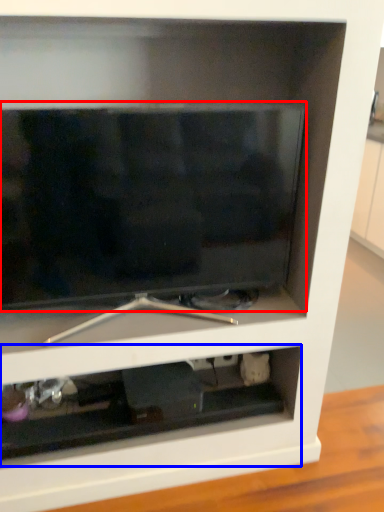
Question: Which point is closer to the camera, television (highlighted by a red box) or cabinet (highlighted by a blue box)?

Choices:
 (A) television
 (B) cabinet

Answer: (A)